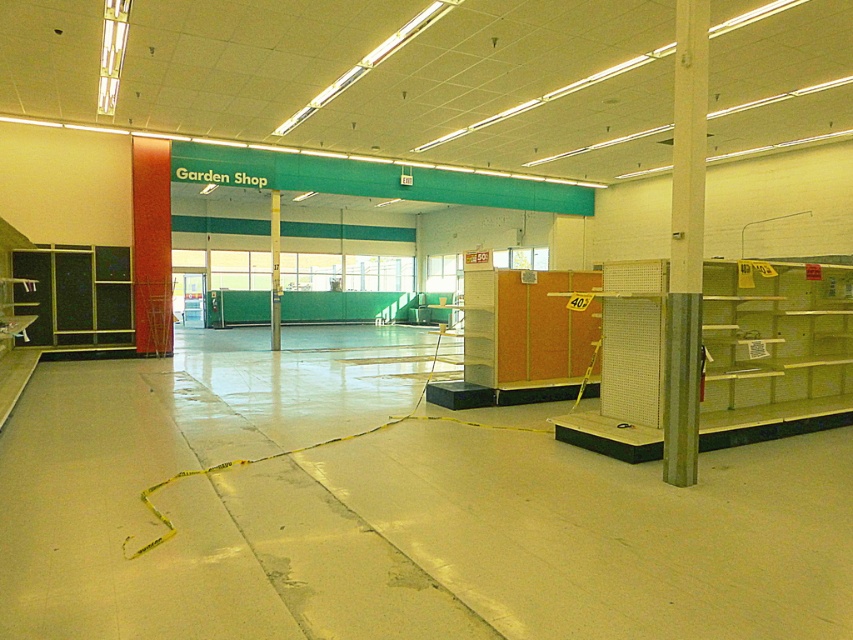
Question: Does matte black cabinet at left lie behind green painted wood pillar at center?

Choices:
 (A) no
 (B) yes

Answer: (A)

Question: Which of the following is the farthest from the observer?

Choices:
 (A) (276, 291)
 (B) (115, 321)
 (C) (670, 294)

Answer: (A)

Question: Which of the following is the closest to the observer?

Choices:
 (A) (277, 193)
 (B) (671, 365)

Answer: (B)

Question: Is metallic pole at center-right wider than matte black cabinet at left?

Choices:
 (A) yes
 (B) no

Answer: (B)

Question: Which point is closer to the camera?

Choices:
 (A) (701, 156)
 (B) (271, 204)
 (C) (44, 260)

Answer: (A)

Question: Does metallic pole at center-right appear under matte black cabinet at left?

Choices:
 (A) no
 (B) yes

Answer: (B)